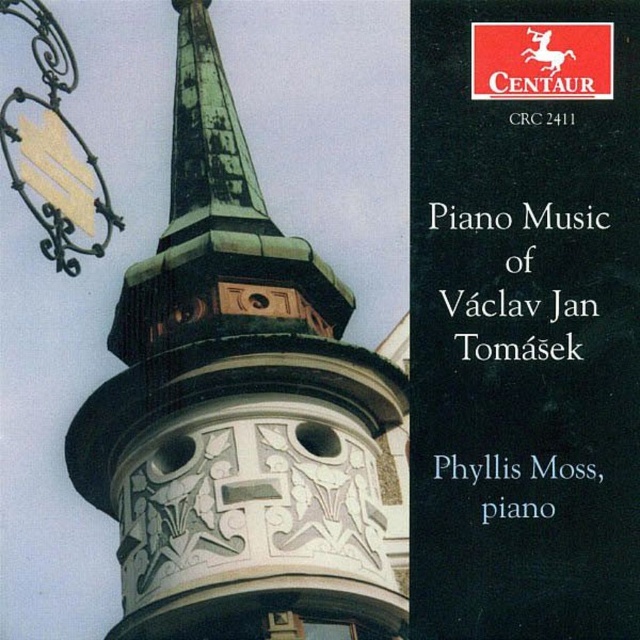
You are designing a layout for a music album cover and need to place two elements based on their sizes. The elements are the green patina spire at upper center and the black paper at upper right. Which element should you place first if you want to prioritize the larger object?

The green patina spire at upper center should be placed first because it is larger in size than the black paper at upper right according to the description.

You are designing a layout for a new album cover and need to ensure the metallic red horse at upper right and the black paper at upper right are positioned correctly. Based on the existing design, which object is shorter in height?

The metallic red horse at upper right is not as tall as the black paper at upper right, so the metallic red horse at upper right is shorter in height.